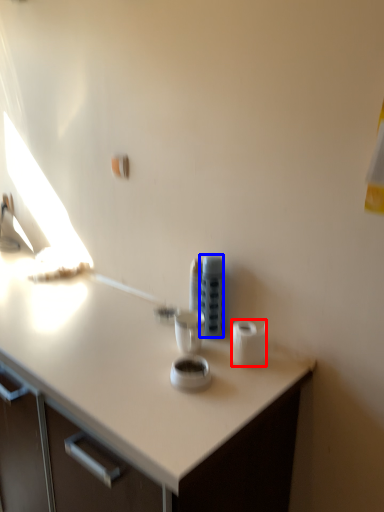
Question: Which object is further to the camera taking this photo, toilet paper (highlighted by a red box) or appliance (highlighted by a blue box)?

Choices:
 (A) toilet paper
 (B) appliance

Answer: (B)